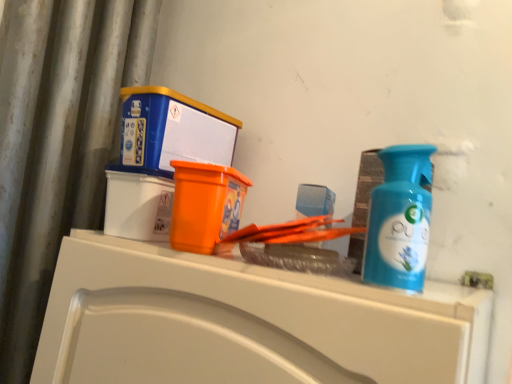
Question: From their relative heights in the image, would you say blue plastic bottle at right is taller or shorter than white glossy counter at upper center?

Choices:
 (A) short
 (B) tall

Answer: (A)

Question: Based on their sizes in the image, would you say blue plastic bottle at right is bigger or smaller than white glossy counter at upper center?

Choices:
 (A) small
 (B) big

Answer: (A)

Question: Which object is the farthest from the blue plastic box at upper left?

Choices:
 (A) blue plastic bottle at right
 (B) white glossy counter at upper center

Answer: (A)

Question: Which is nearer to the white glossy counter at upper center?

Choices:
 (A) blue plastic bottle at right
 (B) blue plastic box at upper left

Answer: (A)